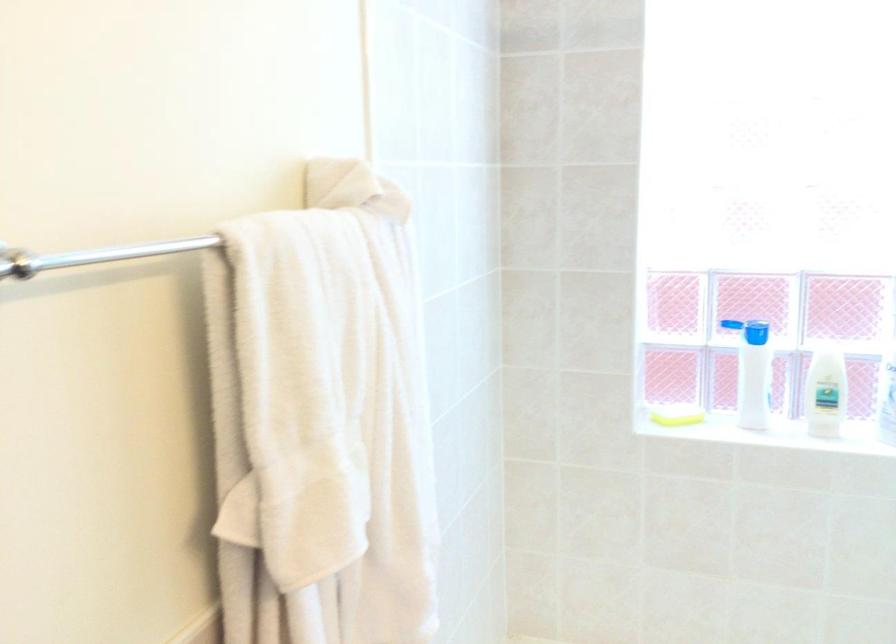
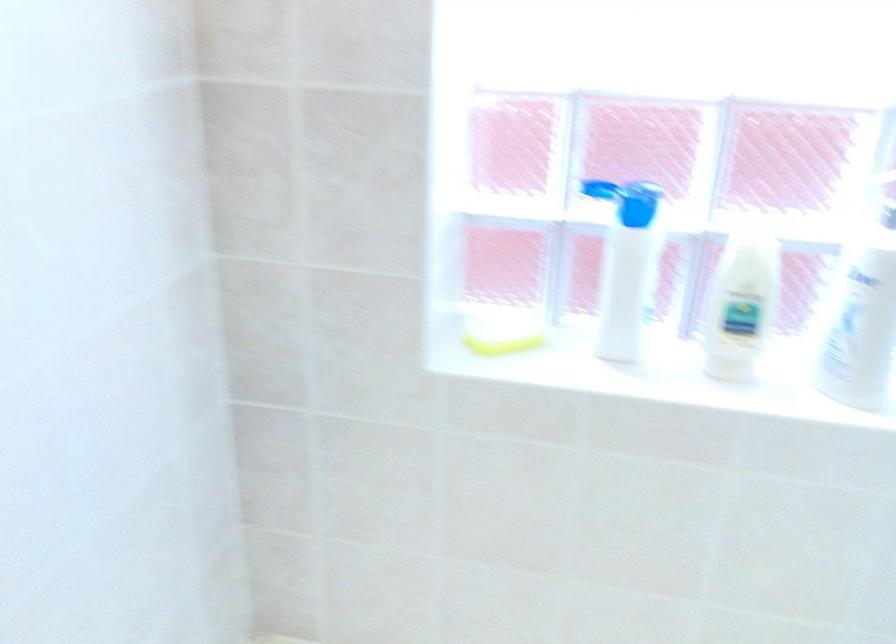
The images are taken continuously from a first-person perspective. In which direction are you moving?

The movement direction of the cameraman is right, forward.